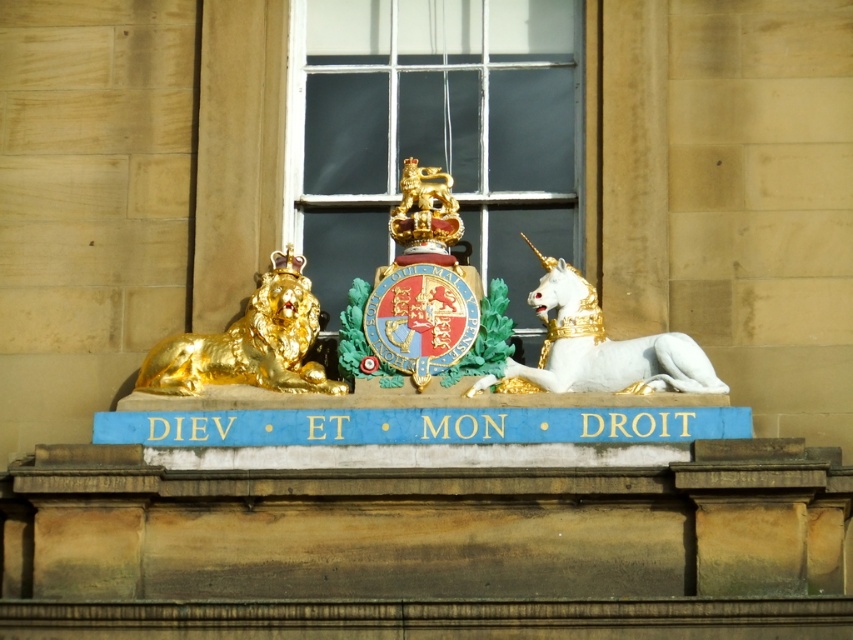
You are an architect inspecting the building facade. You notice the white marble unicorn at center and the gold polished lion at left. Which statue is positioned closer to your viewpoint?

The white marble unicorn at center is closer to the viewer than the gold polished lion at left.

You are an architect designing a new building facade. You have to place a new decorative element at the point specified. The point given is point (601,346). What object is located at this point?

The point (601,346) corresponds to the white marble unicorn at center.